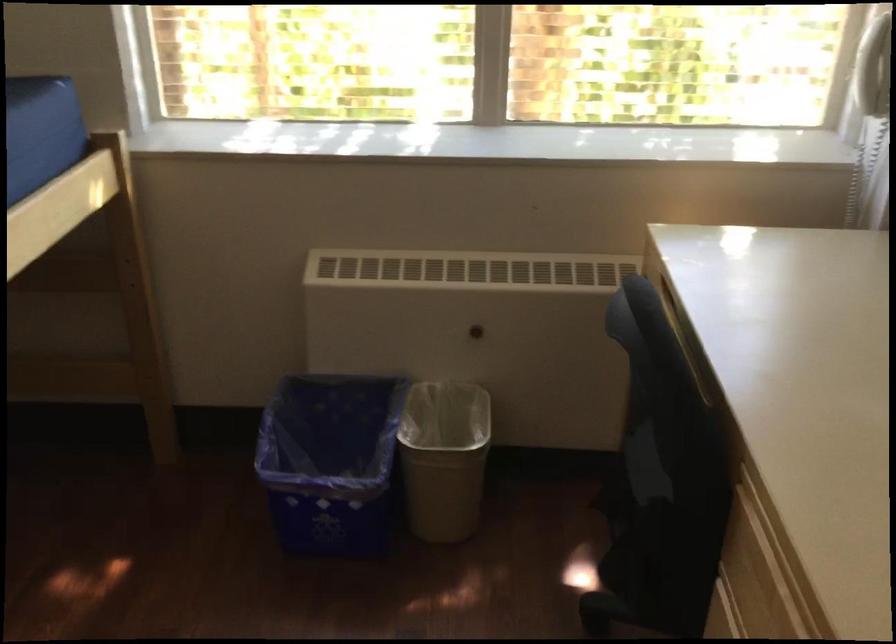
What do you see at coordinates (330, 462) in the screenshot? I see `the blue recycling bin` at bounding box center [330, 462].